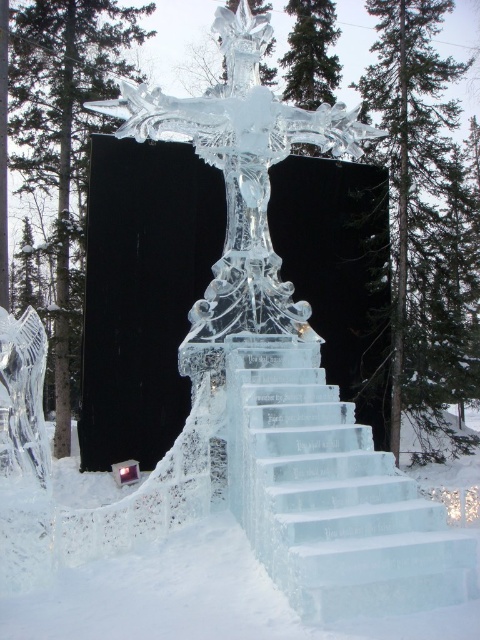
Question: Does clear ice stairs at center appear on the left side of clear ice sculpture at center?

Choices:
 (A) no
 (B) yes

Answer: (A)

Question: Among these points, which one is nearest to the camera?

Choices:
 (A) coord(274,152)
 (B) coord(336,408)

Answer: (B)

Question: Which point is farther from the camera taking this photo?

Choices:
 (A) (275, 435)
 (B) (216, 93)

Answer: (B)

Question: Can you confirm if clear ice stairs at center is thinner than clear ice sculpture at center?

Choices:
 (A) yes
 (B) no

Answer: (B)

Question: Is clear ice stairs at center smaller than clear ice sculpture at center?

Choices:
 (A) yes
 (B) no

Answer: (B)